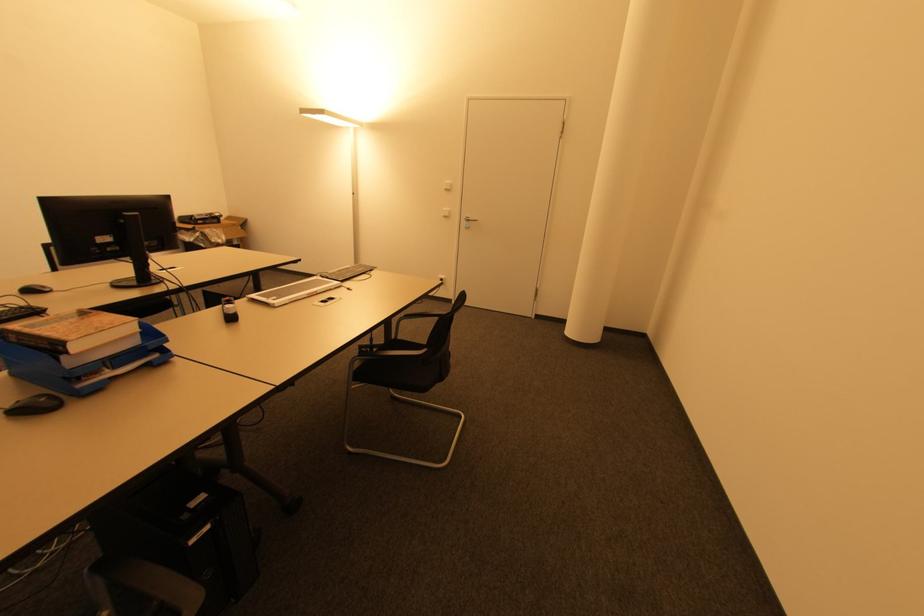
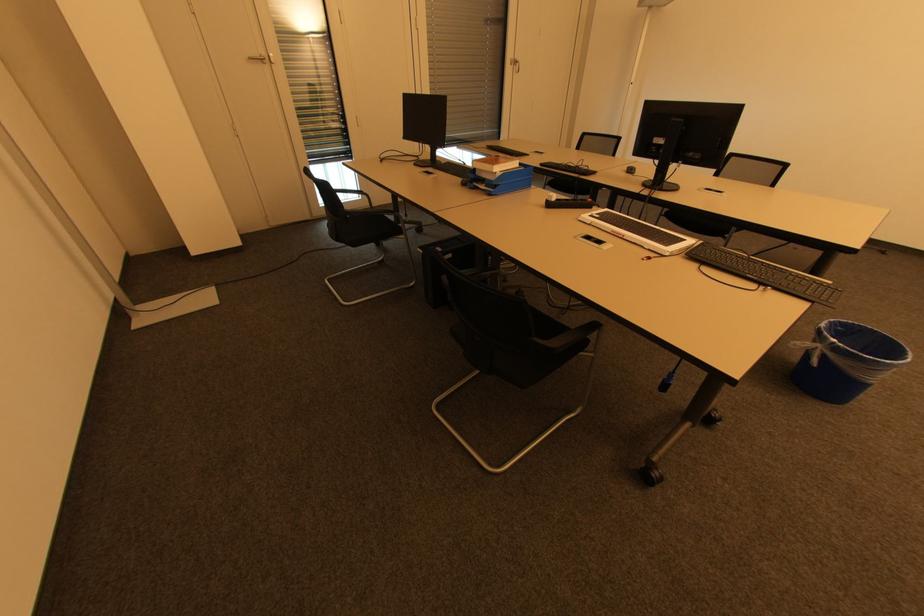
Where in the second image is the point corresponding to point 146,278 from the first image?

(660, 183)